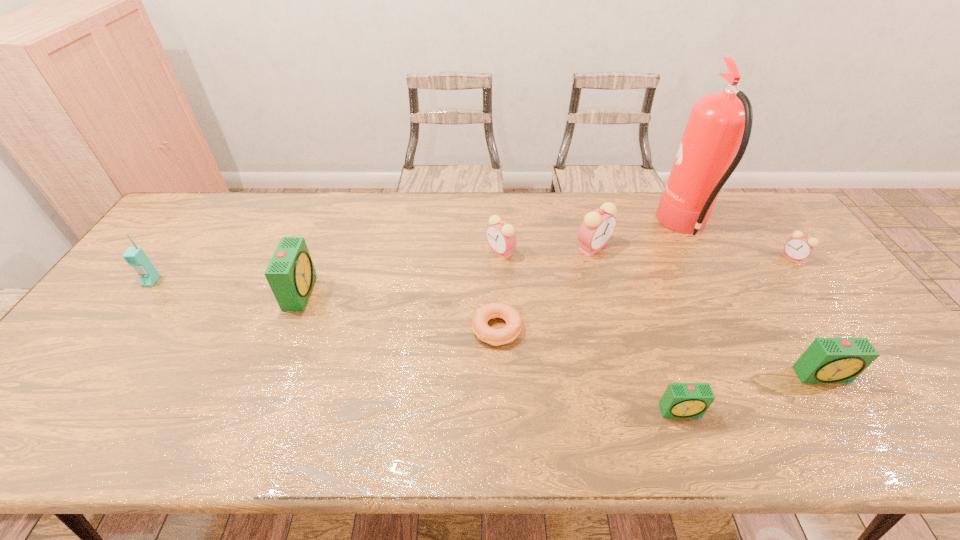
This screenshot has height=540, width=960. Identify the location of vacant space located 0.130m on the face of the biggest pink alarm clock. (605, 290).

At what (x,y) coordinates should I click in order to perform the action: click on vacant space located on the front-facing side of the second object from left to right. Please return your answer as a coordinate pair (x, y). Image resolution: width=960 pixels, height=540 pixels. Looking at the image, I should click on (340, 291).

This screenshot has height=540, width=960. In order to click on free space located on the face of the second alarm clock from left to right in this screenshot , I will do `click(441, 251)`.

The height and width of the screenshot is (540, 960). I want to click on blank space located 0.210m on the face of the second alarm clock from left to right, so pos(419,251).

Where is `vacant space located 0.080m on the face of the second alarm clock from left to right`? The image size is (960, 540). vacant space located 0.080m on the face of the second alarm clock from left to right is located at coordinates click(460, 251).

At what (x,y) coordinates should I click in order to perform the action: click on free space located on the front-facing side of the second nearest green alarm clock. Please return your answer as a coordinate pair (x, y). Looking at the image, I should click on click(x=853, y=424).

What are the coordinates of `vacant space located on the face of the rightmost object` in the screenshot? It's located at (671, 258).

Find the location of a particular element. The height and width of the screenshot is (540, 960). free space located on the face of the rightmost object is located at coordinates (730, 258).

I want to click on vacant space located on the face of the rightmost object, so click(x=707, y=258).

Locate an element on the screen. The height and width of the screenshot is (540, 960). vacant space located on the front-facing side of the nearest green alarm clock is located at coordinates (691, 441).